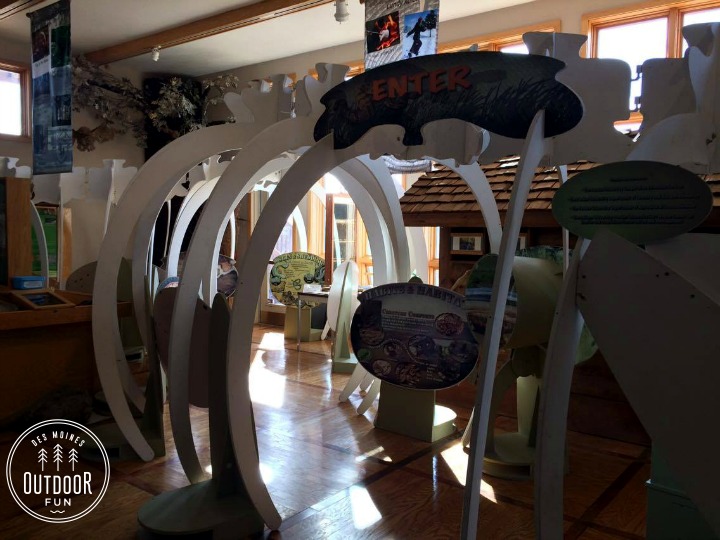
I want to click on desk, so pos(32,333).